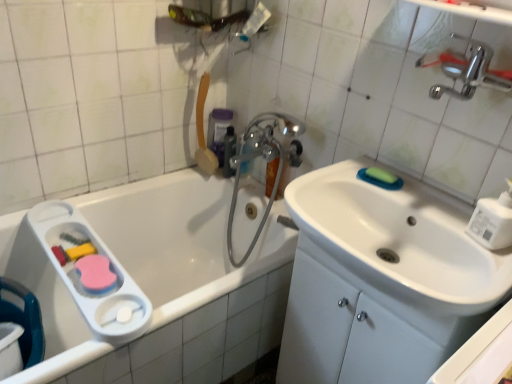
I want to click on vacant area that is situated to the right of green matte soap at upper right, so click(422, 192).